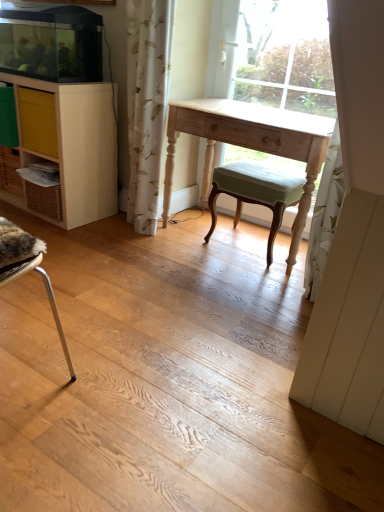
This screenshot has width=384, height=512. Identify the location of free space in front of light wood cabinet at left. [72, 238].